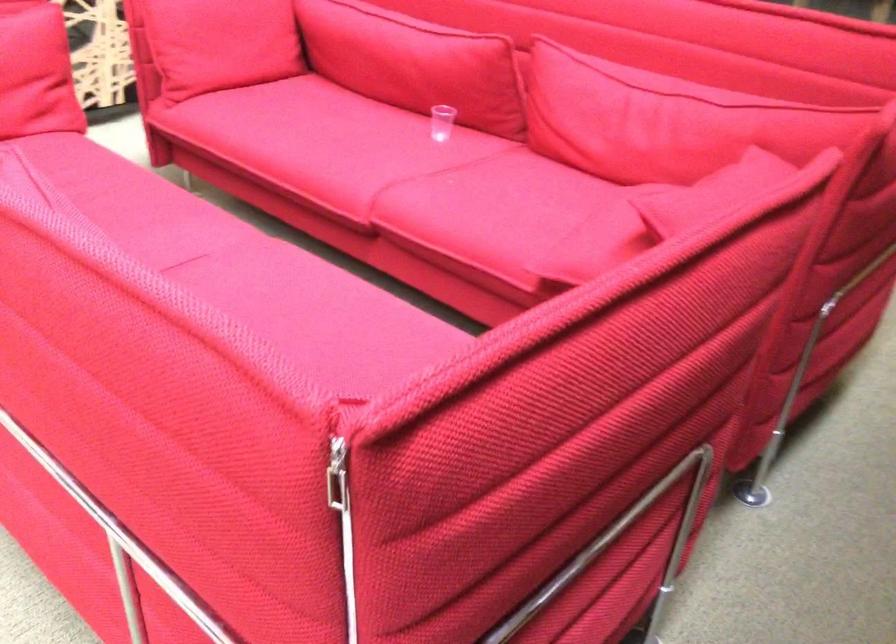
Find the location of a particular element. The width and height of the screenshot is (896, 644). silver zipper pull is located at coordinates (337, 476).